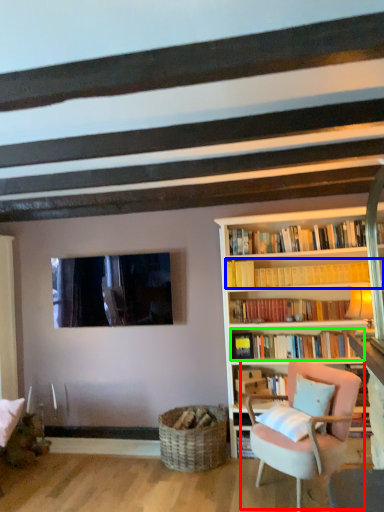
Question: Which object is the closest to the chair (highlighted by a red box)? Choose among these: book (highlighted by a blue box) or book (highlighted by a green box).

Choices:
 (A) book
 (B) book

Answer: (B)